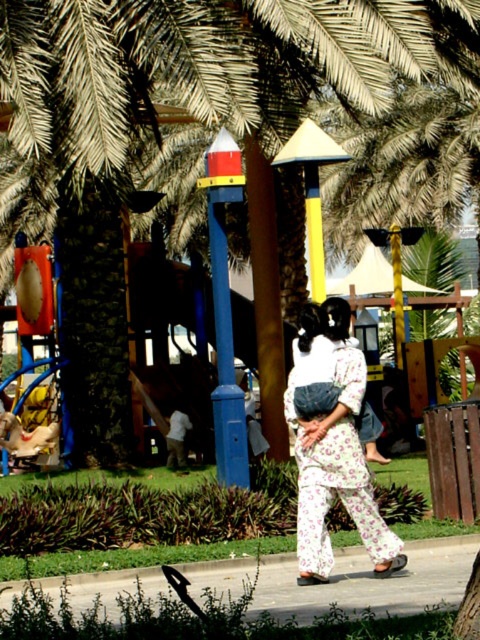
Which is above, green leafy palm tree at center or floral cotton kimono at center?

green leafy palm tree at center

This screenshot has height=640, width=480. What do you see at coordinates (184, 76) in the screenshot? I see `green leafy palm tree at center` at bounding box center [184, 76].

Locate an element on the screen. This screenshot has width=480, height=640. green leafy palm tree at center is located at coordinates (184, 76).

Where is `green leafy palm tree at center`? The width and height of the screenshot is (480, 640). green leafy palm tree at center is located at coordinates (184, 76).